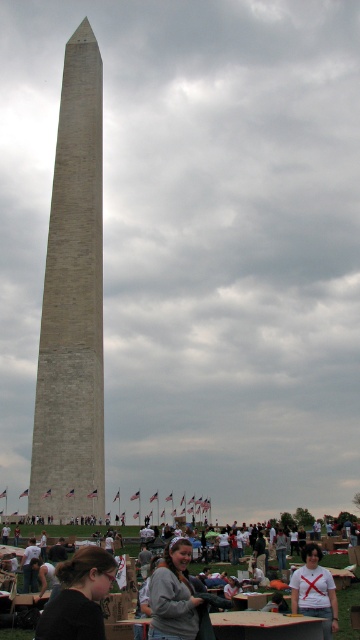
Which is in front, point (70, 568) or point (298, 584)?

Point (70, 568) is more forward.

Which of these two, dark brown hair at lower left or white matte shirt at lower center, stands shorter?

white matte shirt at lower center

The image size is (360, 640). Describe the element at coordinates (78, 596) in the screenshot. I see `dark brown hair at lower left` at that location.

Find the location of `dark brown hair at lower left`. dark brown hair at lower left is located at coordinates (78, 596).

Is dark brown hair at lower left closer to the viewer compared to gray fabric jacket at lower center?

That is True.

Is dark brown hair at lower left taller than gray fabric jacket at lower center?

Yes.

The height and width of the screenshot is (640, 360). What do you see at coordinates (78, 596) in the screenshot? I see `dark brown hair at lower left` at bounding box center [78, 596].

This screenshot has height=640, width=360. I want to click on dark brown hair at lower left, so click(78, 596).

Which of these two, beige stone tower at center or gray sweatshirt at lower center, stands shorter?

gray sweatshirt at lower center

Is point (84, 136) closer to viewer compared to point (164, 564)?

No, it is behind (164, 564).

You are a GUI agent. You are given a task and a screenshot of the screen. Output one action in this format:
    pyautogui.click(x=<x>, y=<y>)
    Task: Click on the beige stone tower at center
    The height and width of the screenshot is (640, 360).
    Given the screenshot: What is the action you would take?
    pyautogui.click(x=73, y=304)